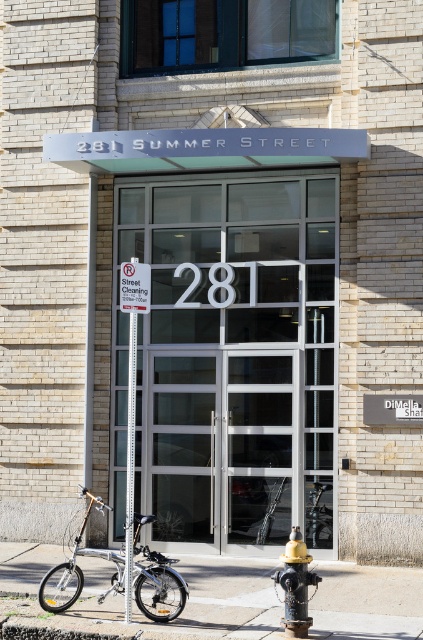
Question: Does metallic street sign at center have a lesser width compared to white paper sign at upper center?

Choices:
 (A) yes
 (B) no

Answer: (A)

Question: Based on their relative distances, which object is farther from the white paper sign at upper center?

Choices:
 (A) concrete sidewalk at lower center
 (B) transparent glass door at center
 (C) black cast iron fire hydrant at lower center

Answer: (B)

Question: Which point appears closest to the camera in this image?

Choices:
 (A) (125, 605)
 (B) (137, 288)
 (C) (238, 616)

Answer: (A)

Question: Does silver metallic bicycle at lower left have a smaller size compared to black cast iron fire hydrant at lower center?

Choices:
 (A) no
 (B) yes

Answer: (A)

Question: Can you confirm if black cast iron fire hydrant at lower center is positioned to the right of metallic street sign at center?

Choices:
 (A) yes
 (B) no

Answer: (A)

Question: Which point is farther from the camera taking this photo?

Choices:
 (A) (25, 556)
 (B) (132, 531)
 (C) (60, 586)
 (D) (184, 477)

Answer: (D)